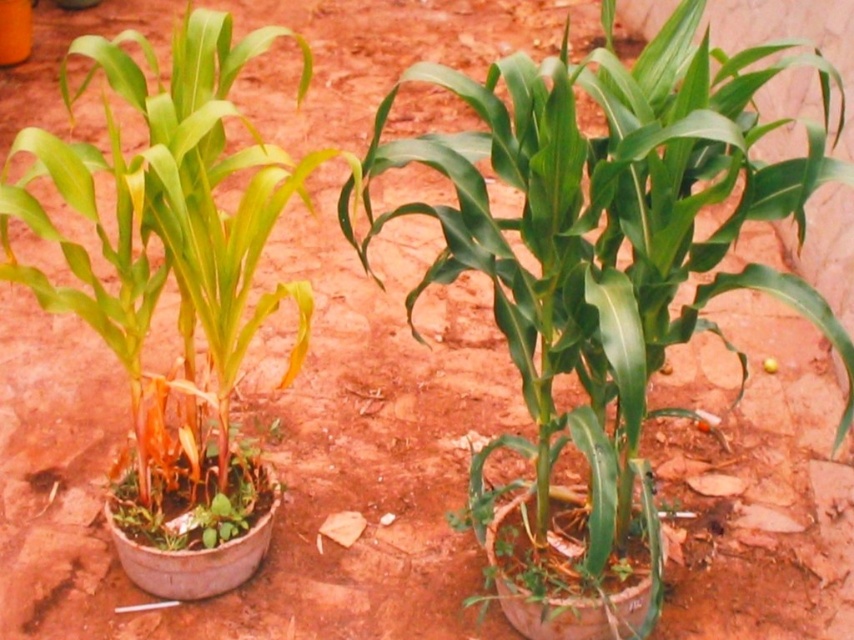
Where is `green leafy plant at center`? This screenshot has width=854, height=640. green leafy plant at center is located at coordinates (607, 236).

Between green leafy plant at center and green matte plant at center, which one appears on the left side from the viewer's perspective?

From the viewer's perspective, green matte plant at center appears more on the left side.

Find the location of a particular element. This screenshot has width=854, height=640. green leafy plant at center is located at coordinates (607, 236).